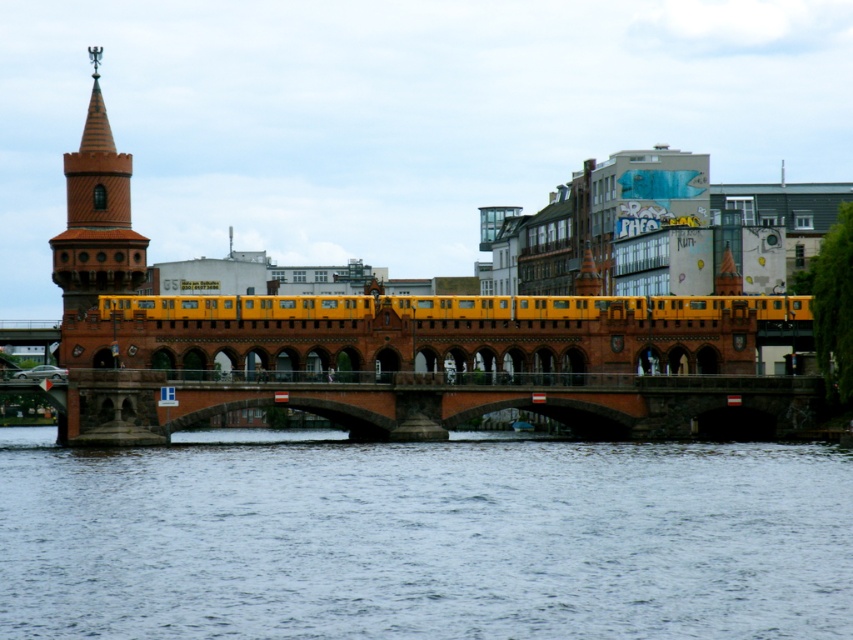
Which is in front, point (86, 486) or point (706, 432)?

Point (86, 486)

Is point (747, 580) more distant than point (192, 397)?

That is False.

The height and width of the screenshot is (640, 853). I want to click on blue water at center, so click(424, 540).

Who is taller, blue water at center or yellow matte train at center?

With more height is blue water at center.

Who is shorter, blue water at center or yellow matte train at center?

Standing shorter between the two is yellow matte train at center.

This screenshot has height=640, width=853. I want to click on blue water at center, so click(x=424, y=540).

Does brick bridge at center lie in front of brown brick tower at left?

That is True.

Who is more forward, (424,403) or (138,252)?

Point (424,403) is more forward.

Between point (416, 406) and point (120, 220), which one is positioned in front?

Point (416, 406)

This screenshot has height=640, width=853. Find the location of `brick bridge at center`. brick bridge at center is located at coordinates (456, 404).